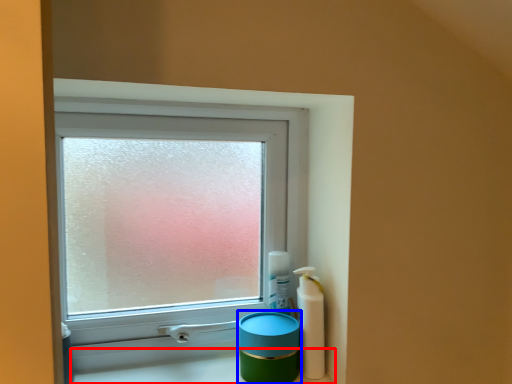
Question: Which object is further to the camera taking this photo, counter top (highlighted by a red box) or teal (highlighted by a blue box)?

Choices:
 (A) counter top
 (B) teal

Answer: (B)